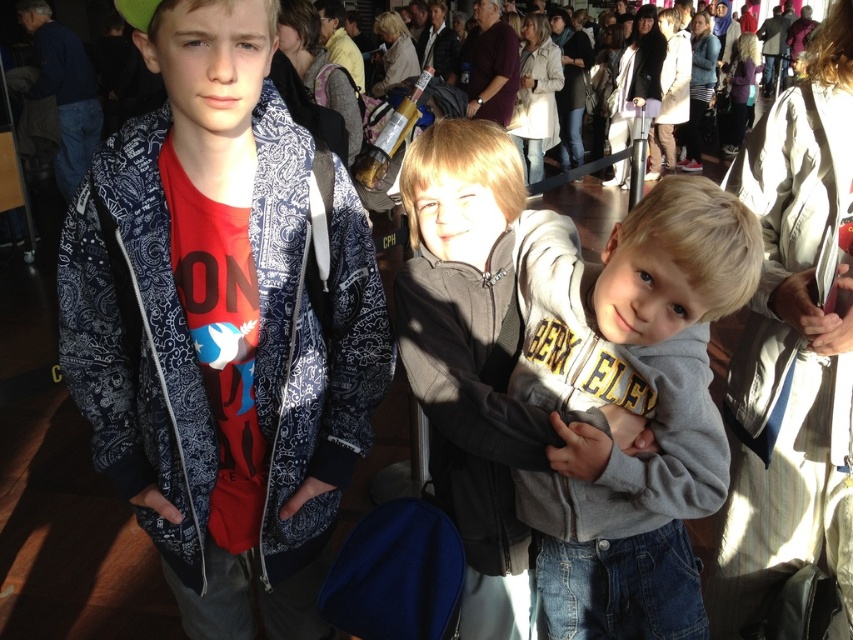
Question: Which object is farther from the camera taking this photo?

Choices:
 (A) gray fleece hoodie at center
 (B) matte blue jacket at center

Answer: (B)

Question: Is matte blue jacket at center smaller than gray fleece hoodie at center?

Choices:
 (A) no
 (B) yes

Answer: (A)

Question: Is matte blue jacket at center bigger than gray fleece hoodie at center?

Choices:
 (A) yes
 (B) no

Answer: (A)

Question: Does matte blue jacket at center have a lesser width compared to gray fleece hoodie at center?

Choices:
 (A) yes
 (B) no

Answer: (B)